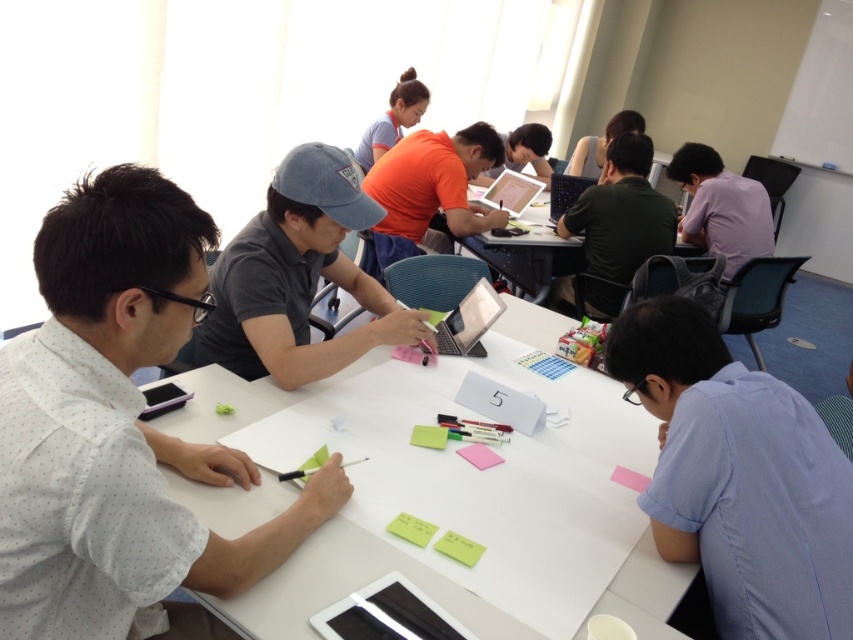
Question: Among these points, which one is nearest to the camera?

Choices:
 (A) (465, 344)
 (B) (616, 472)

Answer: (B)

Question: In this image, where is gray matte shirt at center located relative to satin silver laptop at center?

Choices:
 (A) above
 (B) below

Answer: (A)

Question: Which object is the closest to the pink matte sticky note at center?

Choices:
 (A) matte plastic table at center
 (B) dark green shirt at center

Answer: (B)

Question: Does dark green shirt at center appear on the left side of satin silver laptop at center?

Choices:
 (A) yes
 (B) no

Answer: (B)

Question: Considering the real-world distances, which object is farthest from the pink matte sticky note at lower right?

Choices:
 (A) satin black laptop at center
 (B) white dotted shirt at left
 (C) yellow matte sticky notes at center

Answer: (A)

Question: Is white dotted shirt at left bigger than pink matte sticky note at lower right?

Choices:
 (A) no
 (B) yes

Answer: (B)